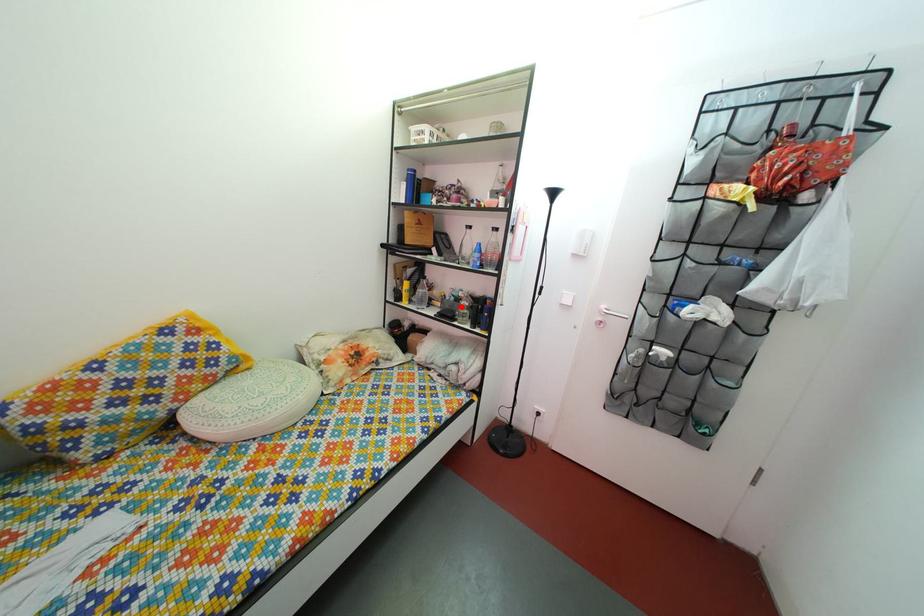
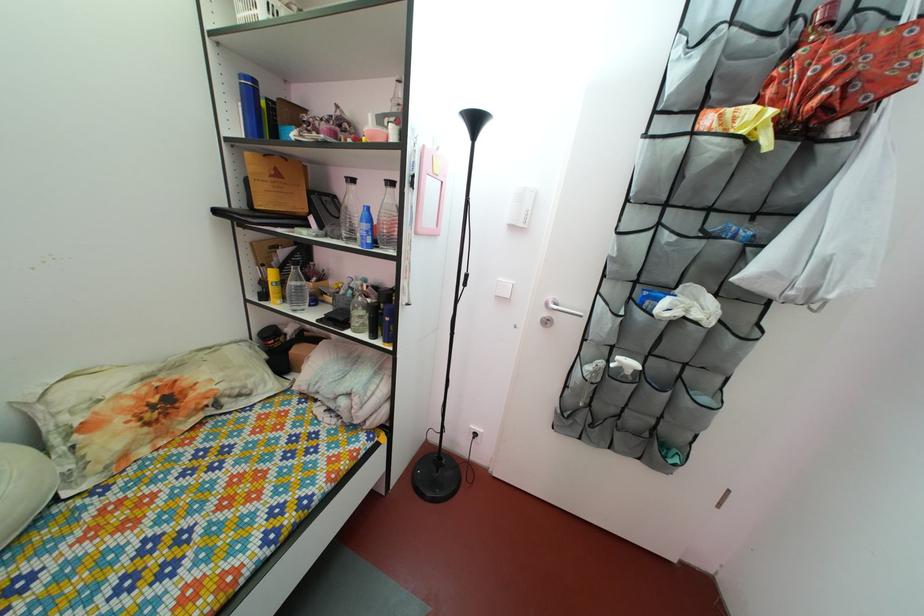
Where in the second image is the point corresponding to the highlighted location from the first image?

(359, 301)